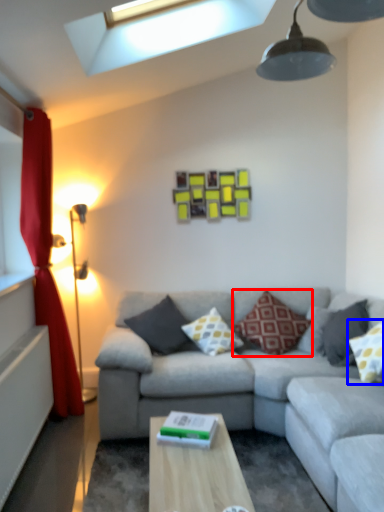
Question: Which object appears farthest to the camera in this image, pillow (highlighted by a red box) or pillow (highlighted by a blue box)?

Choices:
 (A) pillow
 (B) pillow

Answer: (A)